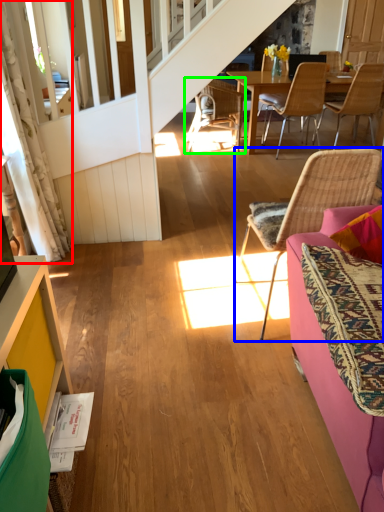
Question: Which is farther away from curtain (highlighted by a red box)? chair (highlighted by a blue box) or chair (highlighted by a green box)?

Choices:
 (A) chair
 (B) chair

Answer: (B)